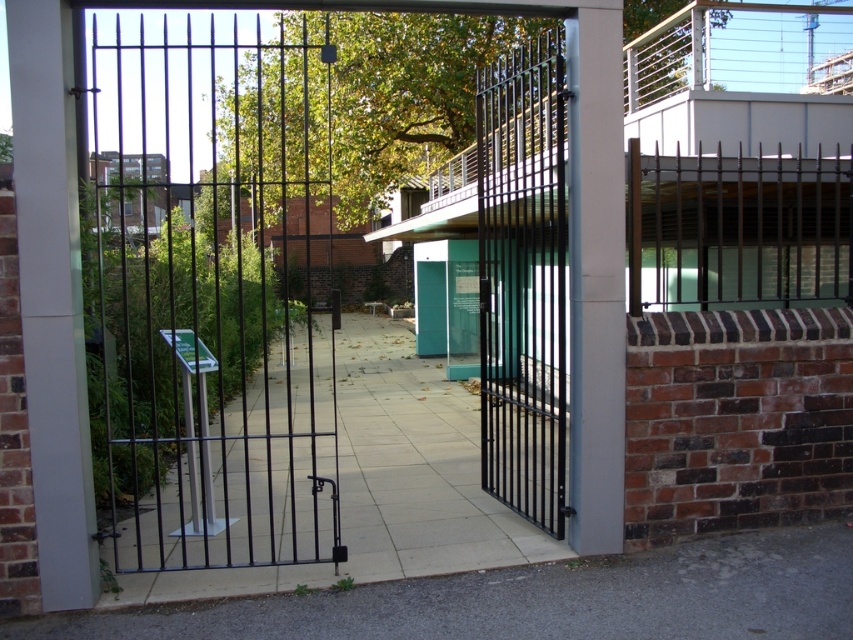
You are a delivery person with a cart that is 2 meters wide. You need to navigate through the space between the gray concrete pavement at lower center and the dark brown metal fence at upper right. Can your cart fit through the gap between them?

The distance between the gray concrete pavement at lower center and the dark brown metal fence at upper right is 4.72 meters. Since your cart is 2 meters wide, it can easily fit through the gap as the space is more than double the cart width.

You are standing at the entrance of the garden and want to walk towards the gray concrete pavement at lower center. According to the image, in which direction should you move from your current position?

The gray concrete pavement at lower center is located at point [538,600], so you should move towards the lower center direction from your current position.